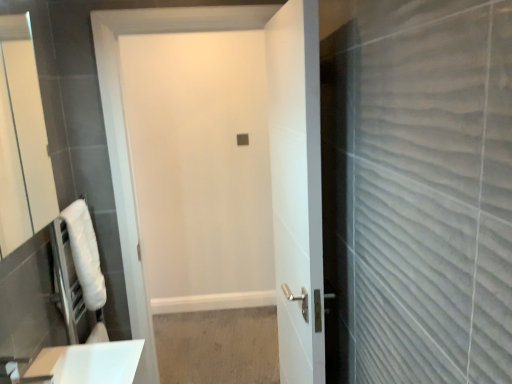
Describe the element at coordinates (69, 287) in the screenshot. The height and width of the screenshot is (384, 512). I see `white towel at left` at that location.

This screenshot has height=384, width=512. Describe the element at coordinates (270, 159) in the screenshot. I see `white matte door at center, acting as the 2th door starting from the right` at that location.

Identify the location of white glossy door at center, which ranks as the 2th door in left-to-right order. Image resolution: width=512 pixels, height=384 pixels. (296, 188).

Image resolution: width=512 pixels, height=384 pixels. What are the coordinates of `white towel at left` in the screenshot? It's located at (69, 287).

From a real-world perspective, who is located higher, white matte door at center, the first door in the left-to-right sequence, or white towel at left?

white matte door at center, the first door in the left-to-right sequence, from a real-world perspective.

Considering the relative sizes of white matte door at center, the first door in the left-to-right sequence, and white towel at left in the image provided, is white matte door at center, the first door in the left-to-right sequence, shorter than white towel at left?

No, white matte door at center, the first door in the left-to-right sequence, is not shorter than white towel at left.

Considering the positions of point (207, 12) and point (61, 279), is point (207, 12) closer or farther from the camera than point (61, 279)?

Point (207, 12) is farther from the camera than point (61, 279).

Is white matte door at center, the first door in the left-to-right sequence, smaller than matte white mirror at left?

No, white matte door at center, the first door in the left-to-right sequence, is not smaller than matte white mirror at left.

Considering the sizes of objects white matte door at center, acting as the 2th door starting from the right, and matte white mirror at left in the image provided, who is shorter, white matte door at center, acting as the 2th door starting from the right, or matte white mirror at left?

matte white mirror at left is shorter.

From the picture: How distant is white matte door at center, the first door in the left-to-right sequence, from matte white mirror at left?

The distance of white matte door at center, the first door in the left-to-right sequence, from matte white mirror at left is 1.36 meters.

Identify the location of mirror to the left of white matte door at center, the first door in the left-to-right sequence. (22, 140).

Can you see white towel at left touching white matte door at center, acting as the 2th door starting from the right?

No, white towel at left is not with white matte door at center, acting as the 2th door starting from the right.

Which of these two, white towel at left or white matte door at center, acting as the 2th door starting from the right, is smaller?

white towel at left.

From the image's perspective, between white towel at left and white matte door at center, the first door in the left-to-right sequence, which one is located above?

white matte door at center, the first door in the left-to-right sequence, appears higher in the image.

Which of these two, white towel at left or white matte door at center, the first door in the left-to-right sequence, stands taller?

With more height is white matte door at center, the first door in the left-to-right sequence.

Can you tell me how much white glossy door at center, which ranks as the 1th door in right-to-left order, and white towel at left differ in facing direction?

white glossy door at center, which ranks as the 1th door in right-to-left order, and white towel at left are facing 175 degrees away from each other.

Based on the photo, is white glossy door at center, which ranks as the 2th door in left-to-right order, to the right of white towel at left from the viewer's perspective?

Indeed, white glossy door at center, which ranks as the 2th door in left-to-right order, is positioned on the right side of white towel at left.

Considering the points (268, 34) and (63, 305), which point is behind, point (268, 34) or point (63, 305)?

The point (268, 34) is farther from the camera.

Does white glossy door at center, which ranks as the 2th door in left-to-right order, contain white towel at left?

No, white glossy door at center, which ranks as the 2th door in left-to-right order, does not contain white towel at left.

From the image's perspective, which is below, matte white mirror at left or white matte door at center, acting as the 2th door starting from the right?

white matte door at center, acting as the 2th door starting from the right, is shown below in the image.

Does matte white mirror at left touch white matte door at center, acting as the 2th door starting from the right?

matte white mirror at left and white matte door at center, acting as the 2th door starting from the right, are clearly separated.

Does point (8, 206) lie in front of point (274, 153)?

No, it is not.

Locate an element on the screen. This screenshot has height=384, width=512. the 2nd door behind the matte white mirror at left, counting from the anchor's position is located at coordinates 270,159.

Could you tell me if white glossy door at center, which ranks as the 2th door in left-to-right order, is facing white matte door at center, acting as the 2th door starting from the right?

No, white glossy door at center, which ranks as the 2th door in left-to-right order, does not turn towards white matte door at center, acting as the 2th door starting from the right.

Between white glossy door at center, which ranks as the 1th door in right-to-left order, and white matte door at center, acting as the 2th door starting from the right, which one has larger width?

With larger width is white glossy door at center, which ranks as the 1th door in right-to-left order.

Which is in front, point (316, 107) or point (196, 12)?

The point (316, 107) is in front.

At what (x,y) coordinates should I click in order to perform the action: click on mirror lying on the right of white towel at left. Please return your answer as a coordinate pair (x, y). The width and height of the screenshot is (512, 384). Looking at the image, I should click on pyautogui.click(x=22, y=140).

Is matte white mirror at left bigger or smaller than white towel at left?

In the image, matte white mirror at left appears to be larger than white towel at left.

How different are the orientations of matte white mirror at left and white towel at left in degrees?

1.88 degrees separate the facing orientations of matte white mirror at left and white towel at left.

Where is `door behind the white towel at left`? door behind the white towel at left is located at coordinates (270, 159).

This screenshot has width=512, height=384. What are the coordinates of `mirror located on the left of white matte door at center, the first door in the left-to-right sequence` in the screenshot? It's located at (22, 140).

In the scene shown: Considering their positions, is white towel at left positioned closer to matte white mirror at left than white glossy door at center, which ranks as the 2th door in left-to-right order?

The object closer to matte white mirror at left is white towel at left.

Considering their positions, is white glossy door at center, which ranks as the 1th door in right-to-left order, positioned closer to white towel at left than white matte door at center, acting as the 2th door starting from the right?

Based on the image, white matte door at center, acting as the 2th door starting from the right, appears to be nearer to white towel at left.

Looking at the image, which one is located further to matte white mirror at left, white glossy door at center, which ranks as the 1th door in right-to-left order, or white matte door at center, acting as the 2th door starting from the right?

Based on the image, white glossy door at center, which ranks as the 1th door in right-to-left order, appears to be further to matte white mirror at left.

In the scene shown: Considering their positions, is white towel at left positioned further to white glossy door at center, which ranks as the 2th door in left-to-right order, than white matte door at center, acting as the 2th door starting from the right?

white towel at left.

Estimate the real-world distances between objects in this image. Which object is closer to matte white mirror at left, white matte door at center, acting as the 2th door starting from the right, or white glossy door at center, which ranks as the 1th door in right-to-left order?

Based on the image, white matte door at center, acting as the 2th door starting from the right, appears to be nearer to matte white mirror at left.

Based on their spatial positions, is white glossy door at center, which ranks as the 2th door in left-to-right order, or white towel at left closer to matte white mirror at left?

white towel at left.

When comparing their distances from matte white mirror at left, does white matte door at center, acting as the 2th door starting from the right, or white towel at left seem further?

white towel at left lies further to matte white mirror at left than the other object.

When comparing their distances from white matte door at center, acting as the 2th door starting from the right, does matte white mirror at left or white glossy door at center, which ranks as the 1th door in right-to-left order, seem further?

matte white mirror at left is further to white matte door at center, acting as the 2th door starting from the right.

Identify the location of door located between matte white mirror at left and white matte door at center, acting as the 2th door starting from the right, in the depth direction. Image resolution: width=512 pixels, height=384 pixels. (296, 188).

At what (x,y) coordinates should I click in order to perform the action: click on appliance between matte white mirror at left and white matte door at center, acting as the 2th door starting from the right, along the z-axis. Please return your answer as a coordinate pair (x, y). The height and width of the screenshot is (384, 512). Looking at the image, I should click on (69, 287).

Where is `mirror between white towel at left and white glossy door at center, which ranks as the 2th door in left-to-right order, from left to right`? Image resolution: width=512 pixels, height=384 pixels. mirror between white towel at left and white glossy door at center, which ranks as the 2th door in left-to-right order, from left to right is located at coordinates (22, 140).

Find the location of a particular element. Image resolution: width=512 pixels, height=384 pixels. door between white towel at left and white glossy door at center, which ranks as the 1th door in right-to-left order, in the horizontal direction is located at coordinates [x=270, y=159].